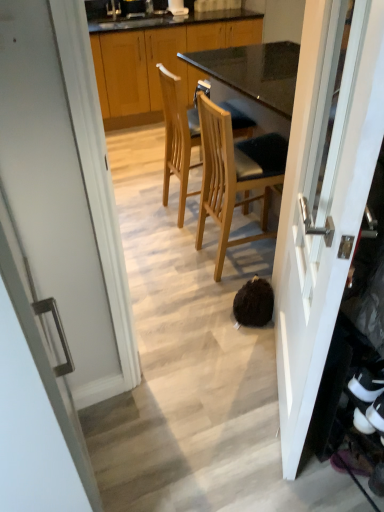
Question: Would you say light brown wood chair at center, arranged as the second chair when viewed from the front, is to the left or to the right of white glossy door at center, which ranks as the 1th door in right-to-left order, in the picture?

Choices:
 (A) left
 (B) right

Answer: (A)

Question: Does point (185, 146) appear closer or farther from the camera than point (301, 116)?

Choices:
 (A) farther
 (B) closer

Answer: (A)

Question: Based on their relative distances, which object is farther from the wooden chair at center, marked as the 1th chair in a front-to-back arrangement?

Choices:
 (A) white glossy door at center, the first door when ordered from left to right
 (B) wooden cabinets at center
 (C) white glossy door at center, which is counted as the 2th door, starting from the left
 (D) light brown wood chair at center, arranged as the second chair when viewed from the front

Answer: (B)

Question: Estimate the real-world distances between objects in this image. Which object is closer to the wooden cabinets at center?

Choices:
 (A) white glossy door at center, the first door when ordered from left to right
 (B) light brown wood chair at center, arranged as the second chair when viewed from the front
 (C) wooden chair at center, which appears as the 2th chair when viewed from the back
 (D) white glossy door at center, which ranks as the 1th door in right-to-left order

Answer: (B)